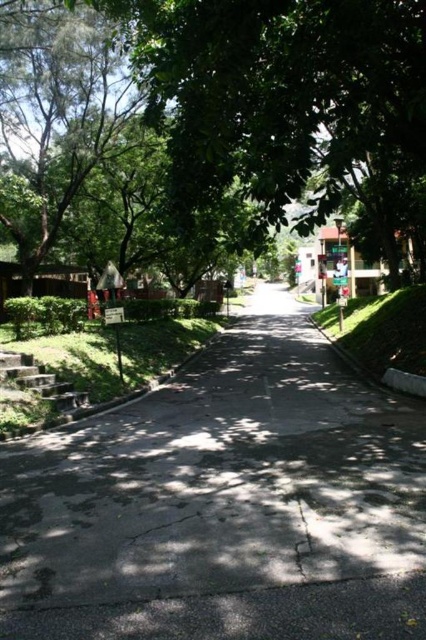
Can you confirm if gray concrete pavement at lower left is shorter than green leafy tree at upper left?

Indeed, gray concrete pavement at lower left has a lesser height compared to green leafy tree at upper left.

You are a GUI agent. You are given a task and a screenshot of the screen. Output one action in this format:
    pyautogui.click(x=<x>, y=<y>)
    Task: Click on the gray concrete pavement at lower left
    
    Given the screenshot: What is the action you would take?
    pyautogui.click(x=224, y=502)

Where is `gray concrete pavement at lower left`? The height and width of the screenshot is (640, 426). gray concrete pavement at lower left is located at coordinates (224, 502).